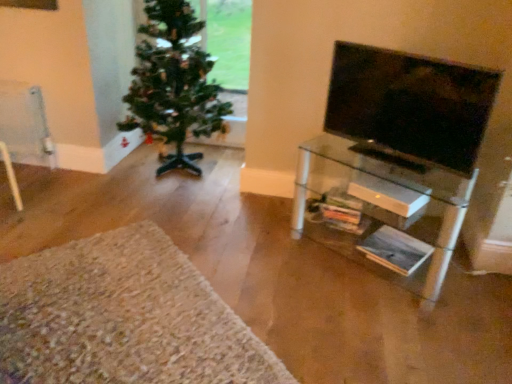
Where is `vacant region below green matte christmas tree at left (from a real-world perspective)`? The width and height of the screenshot is (512, 384). vacant region below green matte christmas tree at left (from a real-world perspective) is located at coordinates (186, 167).